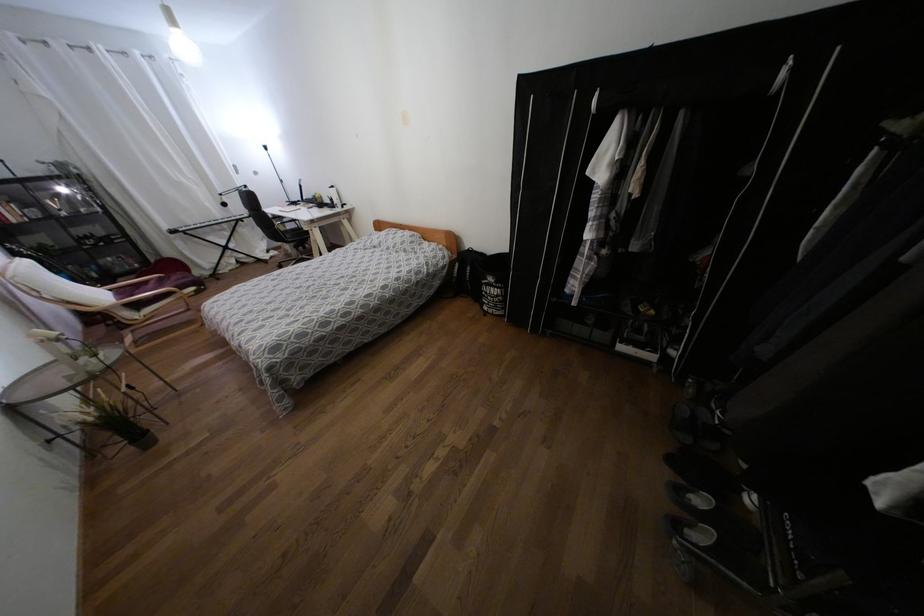
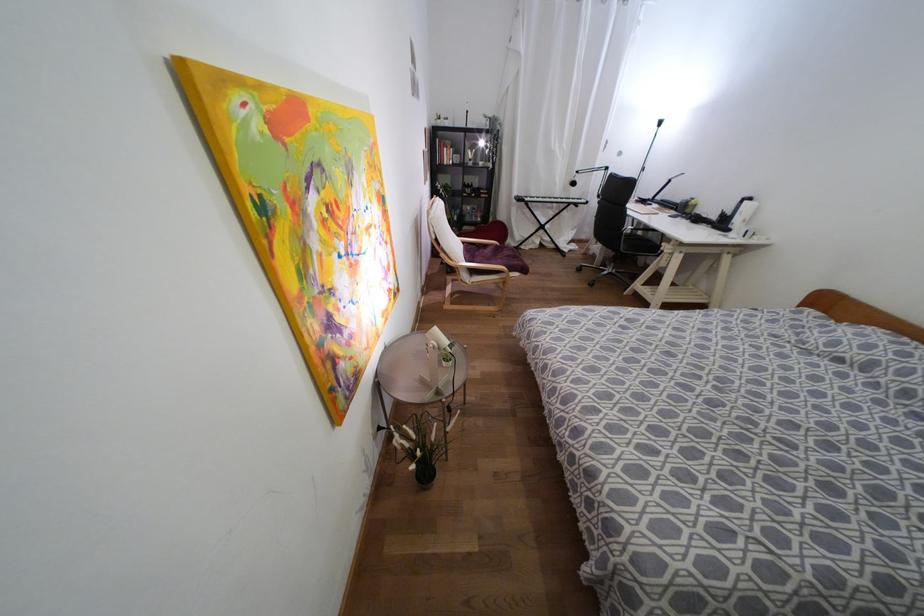
Find the pixel in the second image that matches the point at 332,187 in the first image.

(749, 198)